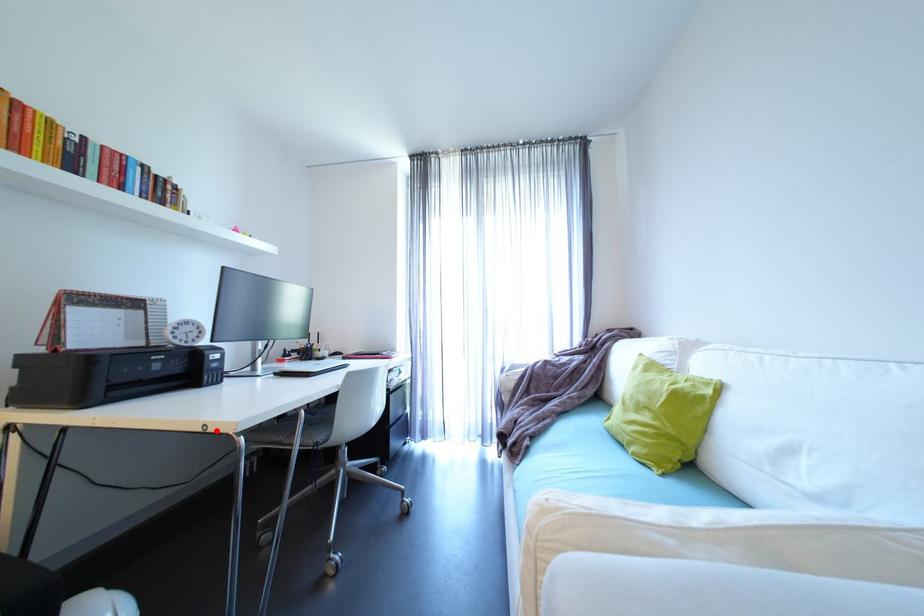
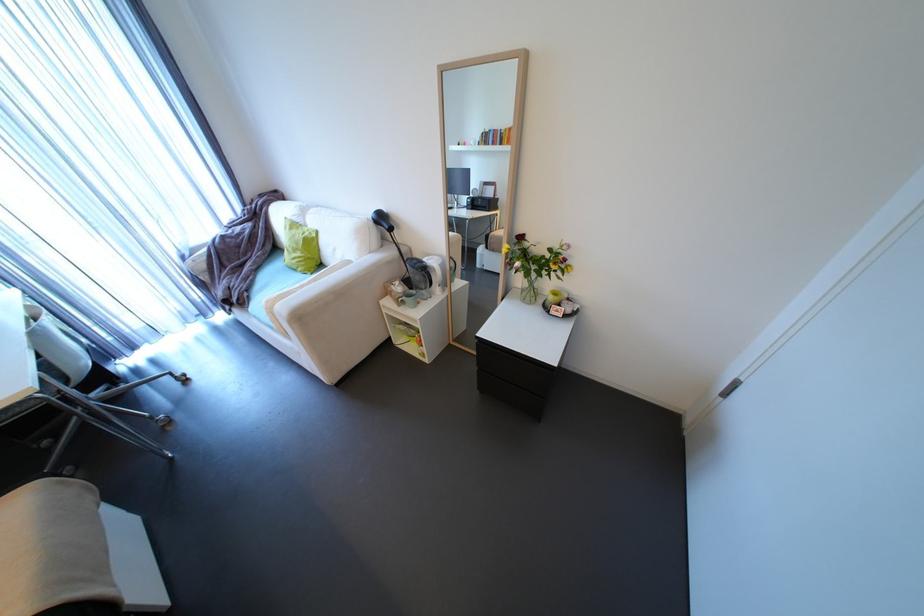
In the second image, find the point that corresponds to the highlighted location in the first image.

(7, 408)